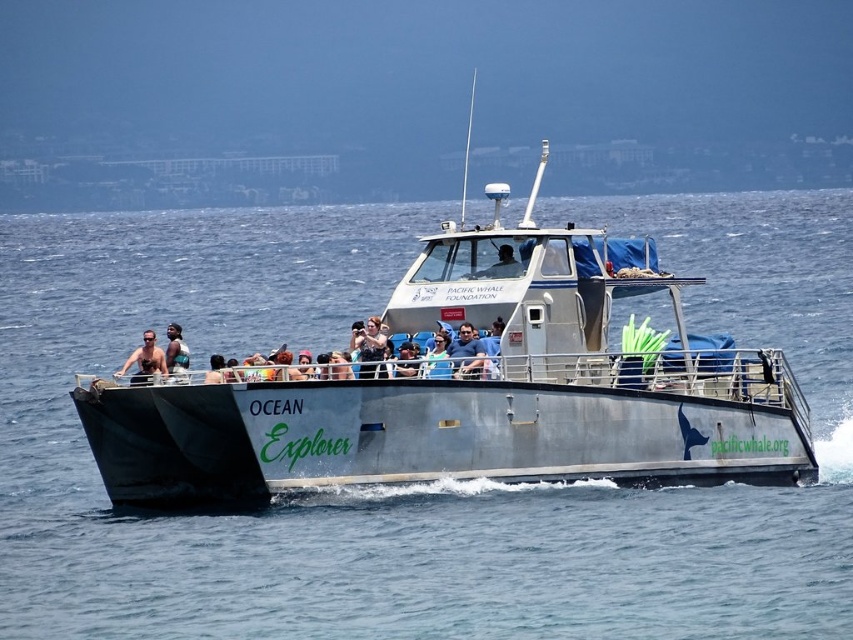
Which of these two, blue fabric shirt at center or tan skin person at center, stands shorter?

blue fabric shirt at center is shorter.

Who is positioned more to the right, blue fabric shirt at center or tan skin person at center?

From the viewer's perspective, blue fabric shirt at center appears more on the right side.

Image resolution: width=853 pixels, height=640 pixels. What do you see at coordinates (466, 353) in the screenshot?
I see `blue fabric shirt at center` at bounding box center [466, 353].

This screenshot has height=640, width=853. What are the coordinates of `blue fabric shirt at center` in the screenshot? It's located at (466, 353).

Does metallic gray boat at center appear on the right side of blue fabric shirt at center?

Yes, metallic gray boat at center is to the right of blue fabric shirt at center.

Who is lower down, metallic gray boat at center or blue fabric shirt at center?

blue fabric shirt at center

Between point (749, 474) and point (459, 369), which one is positioned in front?

Point (459, 369) is in front.

Find the location of `metallic gray boat at center`. metallic gray boat at center is located at coordinates (469, 388).

Can you confirm if metallic gray boat at center is wider than tan skin person at center?

Yes.

Based on the photo, does metallic gray boat at center have a lesser width compared to tan skin person at center?

Incorrect, metallic gray boat at center's width is not less than tan skin person at center's.

Locate an element on the screen. metallic gray boat at center is located at coordinates (469, 388).

Locate an element on the screen. The height and width of the screenshot is (640, 853). metallic gray boat at center is located at coordinates (469, 388).